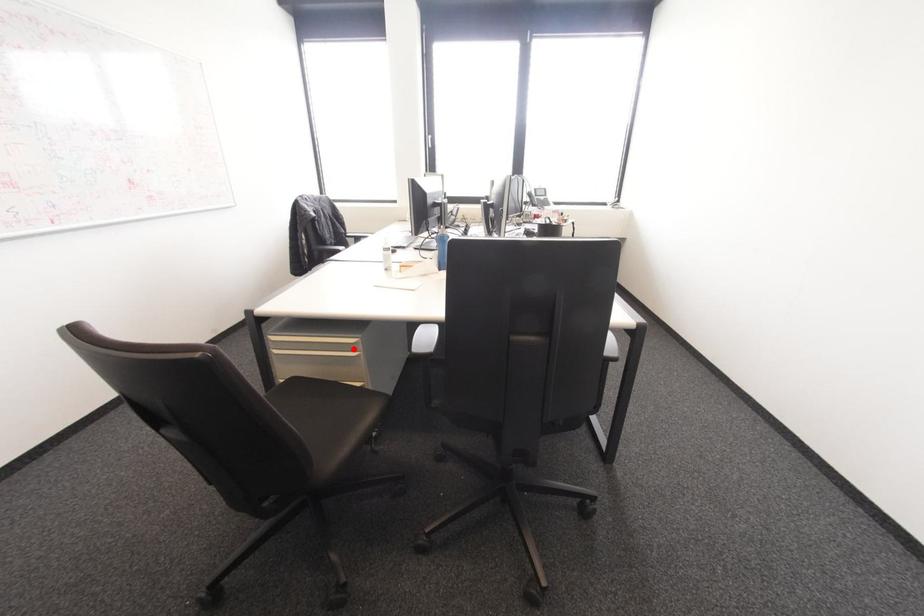
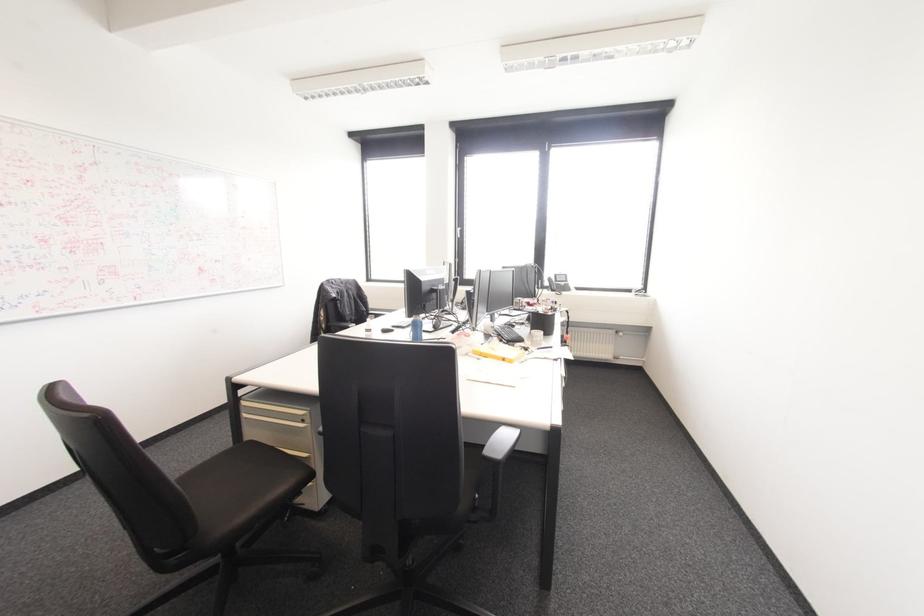
Question: I am providing you with two images of the same scene from different viewpoints. In image1, a red point is highlighted. Considering the same 3D point in image2, which of the following is correct?

Choices:
 (A) It is closer
 (B) It is farther

Answer: (B)